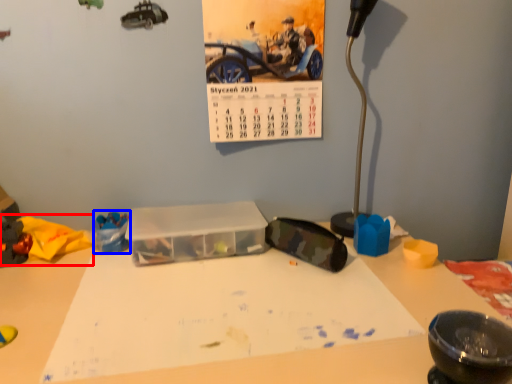
Question: Which point is further to the camera, toy (highlighted by a red box) or toy (highlighted by a blue box)?

Choices:
 (A) toy
 (B) toy

Answer: (B)